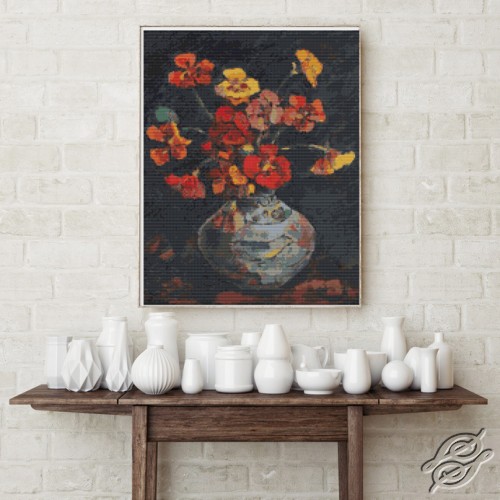
This screenshot has height=500, width=500. What are the coordinates of `vase` in the screenshot? It's located at (50, 357).